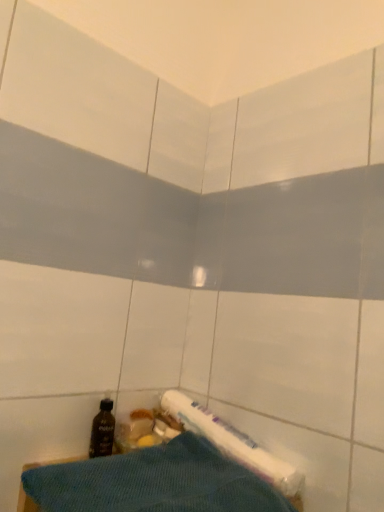
Question: Based on their sizes in the image, would you say black plastic bottle at lower left is bigger or smaller than blue textured towel at lower center?

Choices:
 (A) small
 (B) big

Answer: (A)

Question: Would you say black plastic bottle at lower left is inside or outside blue textured towel at lower center?

Choices:
 (A) outside
 (B) inside

Answer: (A)

Question: Considering their positions, is black plastic bottle at lower left located in front of or behind blue textured towel at lower center?

Choices:
 (A) behind
 (B) front

Answer: (A)

Question: Is blue textured towel at lower center in front of or behind black plastic bottle at lower left in the image?

Choices:
 (A) behind
 (B) front

Answer: (B)

Question: Considering the positions of blue textured towel at lower center and black plastic bottle at lower left in the image, is blue textured towel at lower center taller or shorter than black plastic bottle at lower left?

Choices:
 (A) short
 (B) tall

Answer: (B)

Question: Looking at their shapes, would you say blue textured towel at lower center is wider or thinner than black plastic bottle at lower left?

Choices:
 (A) thin
 (B) wide

Answer: (B)

Question: From the image's perspective, is blue textured towel at lower center above or below black plastic bottle at lower left?

Choices:
 (A) above
 (B) below

Answer: (B)